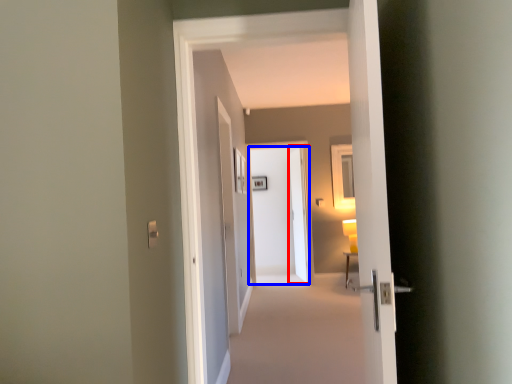
Question: Among these objects, which one is nearest to the camera, screen door (highlighted by a red box) or door (highlighted by a blue box)?

Choices:
 (A) screen door
 (B) door

Answer: (B)